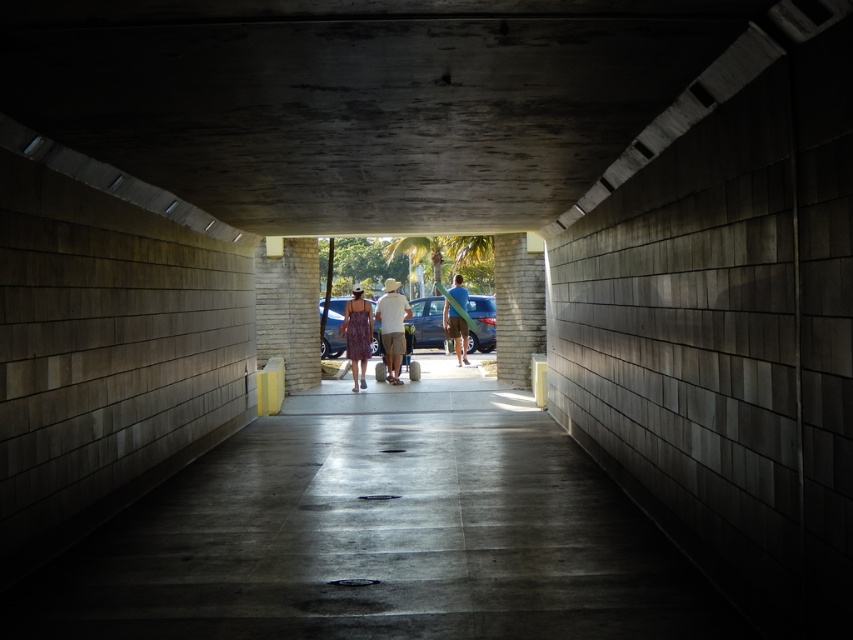
Question: Is metallic blue car at center below matte purple dress at center?

Choices:
 (A) no
 (B) yes

Answer: (A)

Question: Is concrete ceiling at center thinner than green surfboard at center?

Choices:
 (A) no
 (B) yes

Answer: (B)

Question: Which of the following is the farthest from the observer?

Choices:
 (A) green surfboard at center
 (B) concrete ceiling at center
 (C) matte white shirt at center

Answer: (A)

Question: Where is matte white shirt at center located in relation to green surfboard at center in the image?

Choices:
 (A) below
 (B) above

Answer: (B)

Question: Which object appears farthest from the camera in this image?

Choices:
 (A) matte purple dress at center
 (B) metallic blue car at center

Answer: (B)

Question: Which object is the farthest from the concrete ceiling at center?

Choices:
 (A) concrete at center
 (B) matte purple dress at center
 (C) matte white shirt at center
 (D) metallic blue car at center

Answer: (D)